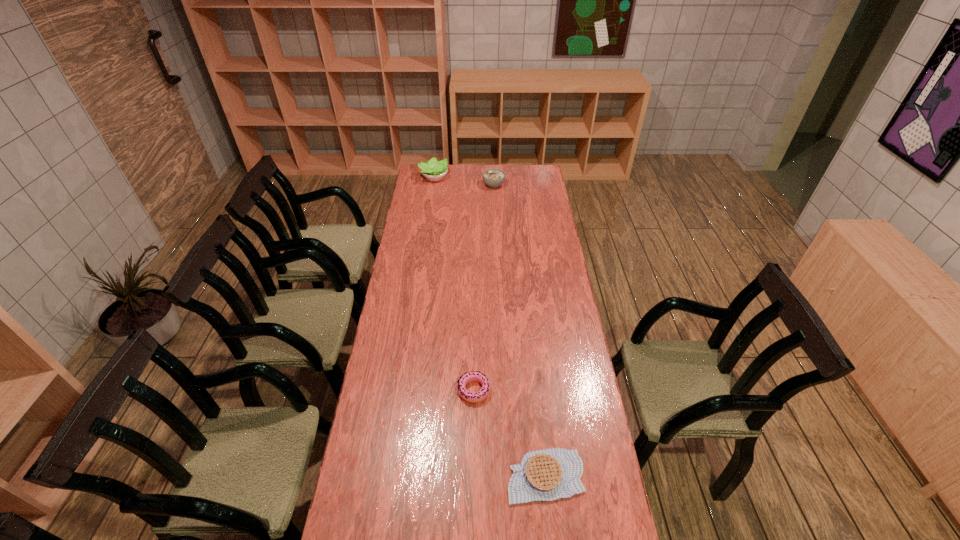
In order to click on vacant space that satisfies the following two spatial constraints: 1. on the front side of the nearest object; 2. on the left side of the soup bowl in this screenshot , I will do `click(506, 476)`.

Identify the location of blank space that satisfies the following two spatial constraints: 1. on the front side of the doughnut; 2. on the left side of the pie. (473, 476).

Find the location of `free location that satisfies the following two spatial constraints: 1. on the front side of the lettuce; 2. on the left side of the soup bowl`. free location that satisfies the following two spatial constraints: 1. on the front side of the lettuce; 2. on the left side of the soup bowl is located at coordinates (433, 185).